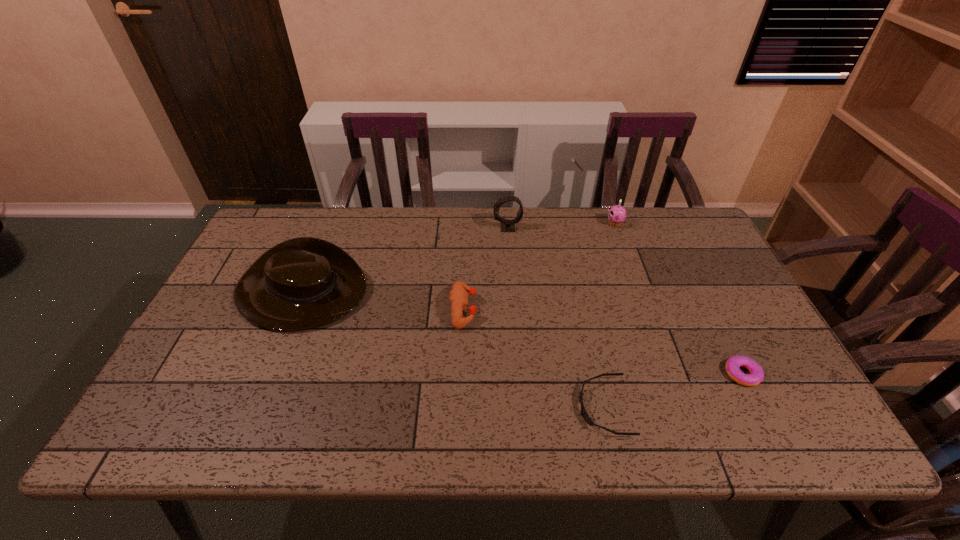
Where is `blank region between the leftmost object and the shortest object`? Image resolution: width=960 pixels, height=540 pixels. blank region between the leftmost object and the shortest object is located at coordinates (452, 349).

Identify which object is the third nearest to the rightmost object. Please provide its 2D coordinates. Your answer should be formatted as a tuple, i.e. [(x, y)], where the tuple contains the x and y coordinates of a point satisfying the conditions above.

[(458, 295)]

The image size is (960, 540). What are the coordinates of `the fifth closest object to the rightmost object` in the screenshot? It's located at (302, 283).

This screenshot has height=540, width=960. I want to click on blank space that satisfies the following two spatial constraints: 1. on the face of the fourth object from right to left; 2. on the front side of the cowboy hat, so click(x=512, y=292).

The image size is (960, 540). In order to click on vacant space that satisfies the following two spatial constraints: 1. on the back side of the doughnut; 2. on the face of the watch in this screenshot , I will do `click(669, 228)`.

Find the location of a particular element. vacant space that satisfies the following two spatial constraints: 1. on the face of the third object from left to right; 2. on the front side of the cowboy hat is located at coordinates (512, 292).

The image size is (960, 540). Identify the location of vacant point that satisfies the following two spatial constraints: 1. on the face of the rightmost object; 2. on the left side of the fourth object from right to left. (x=518, y=374).